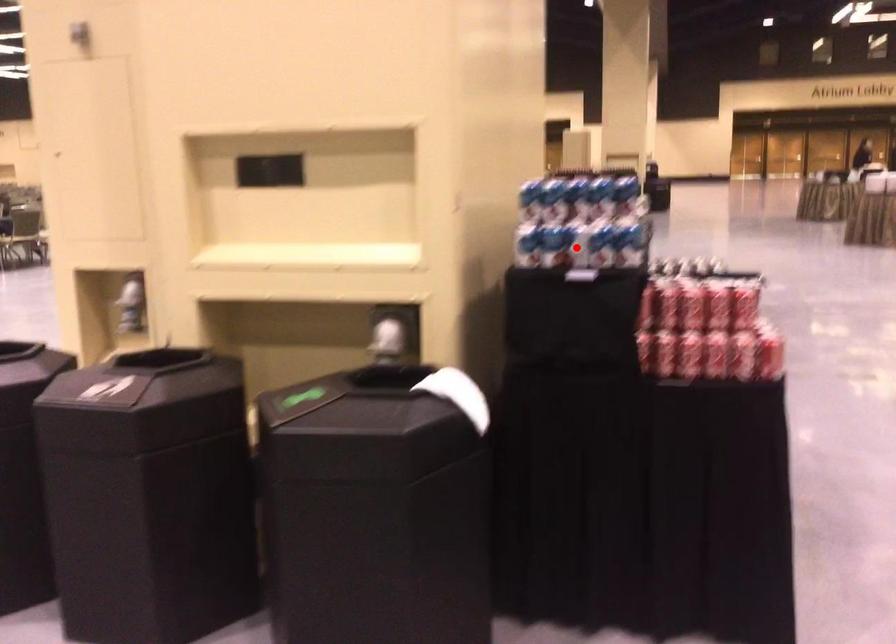
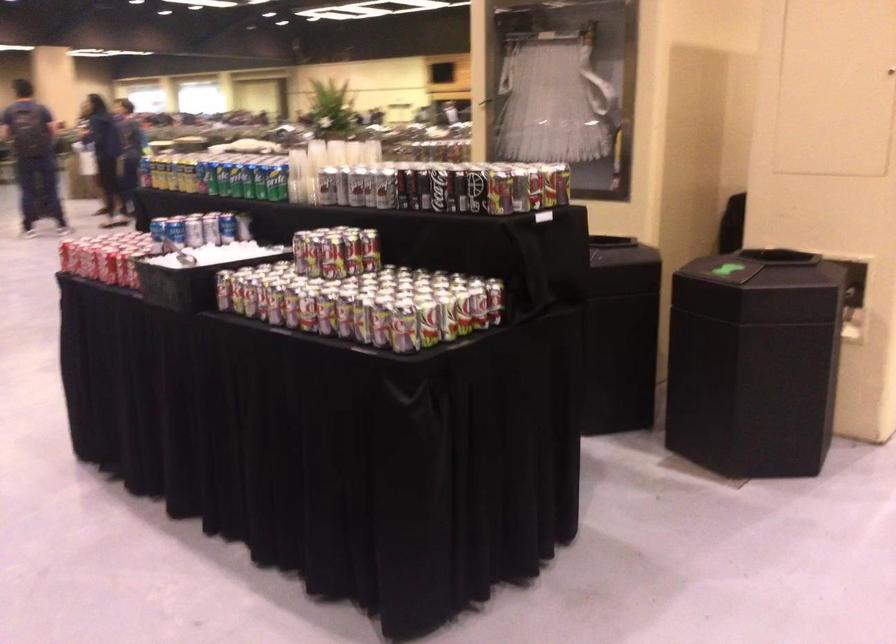
Question: I am providing you with two images of the same scene from different viewpoints. A red point is marked on the first image. At the location where the point appears in image 1, is it still visible in image 2?

Choices:
 (A) Yes
 (B) No

Answer: (B)